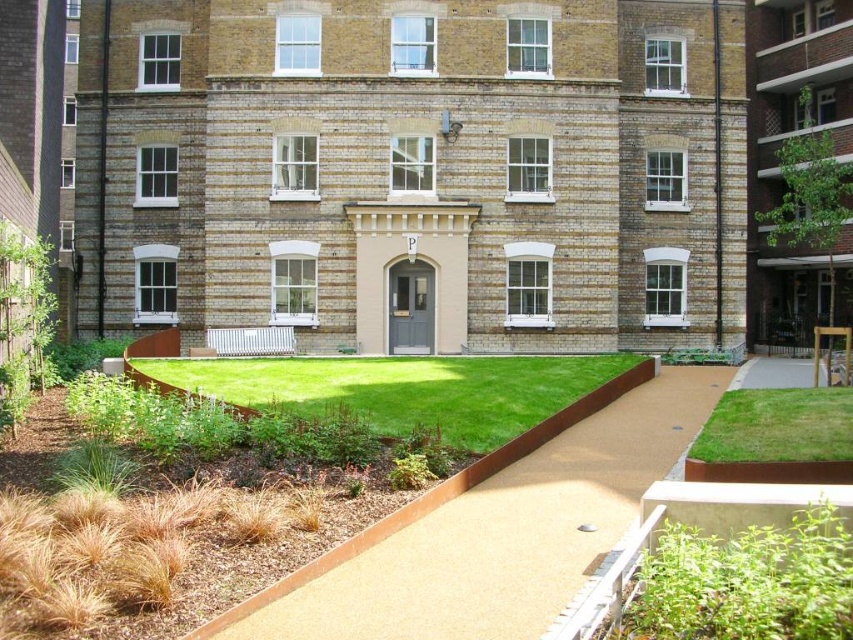
Question: Is green grass at center closer to camera compared to green grass at lower right?

Choices:
 (A) yes
 (B) no

Answer: (B)

Question: Which of the following is the closest to the observer?

Choices:
 (A) green grass at lower right
 (B) green grass at center

Answer: (A)

Question: Which of these objects is positioned farthest from the resin-coated pathway at center?

Choices:
 (A) green grass at center
 (B) green grass at lower right

Answer: (A)

Question: Does resin-coated pathway at center have a larger size compared to green grass at lower right?

Choices:
 (A) no
 (B) yes

Answer: (B)

Question: Among these objects, which one is farthest from the camera?

Choices:
 (A) green grass at lower right
 (B) resin-coated pathway at center

Answer: (A)

Question: Is resin-coated pathway at center wider than green grass at center?

Choices:
 (A) yes
 (B) no

Answer: (B)